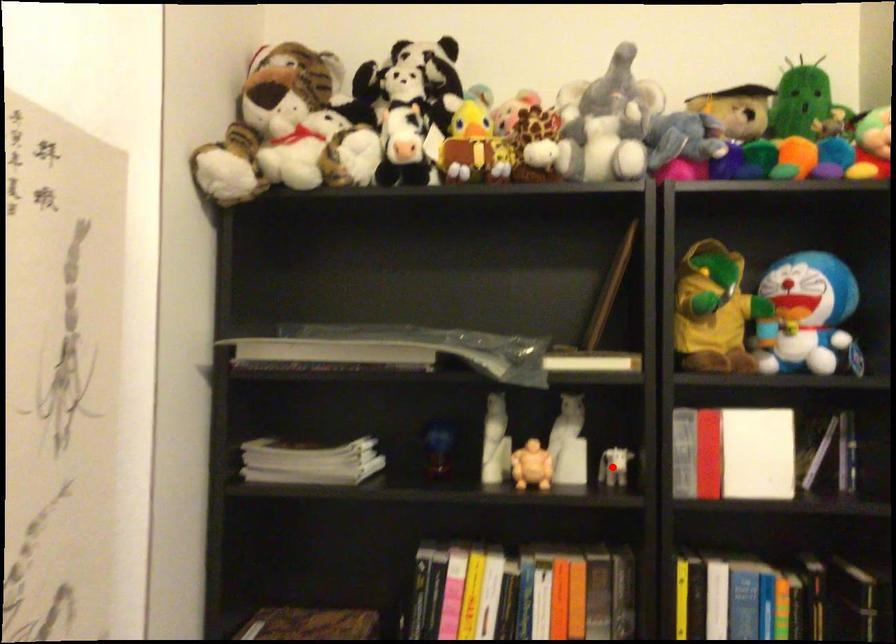
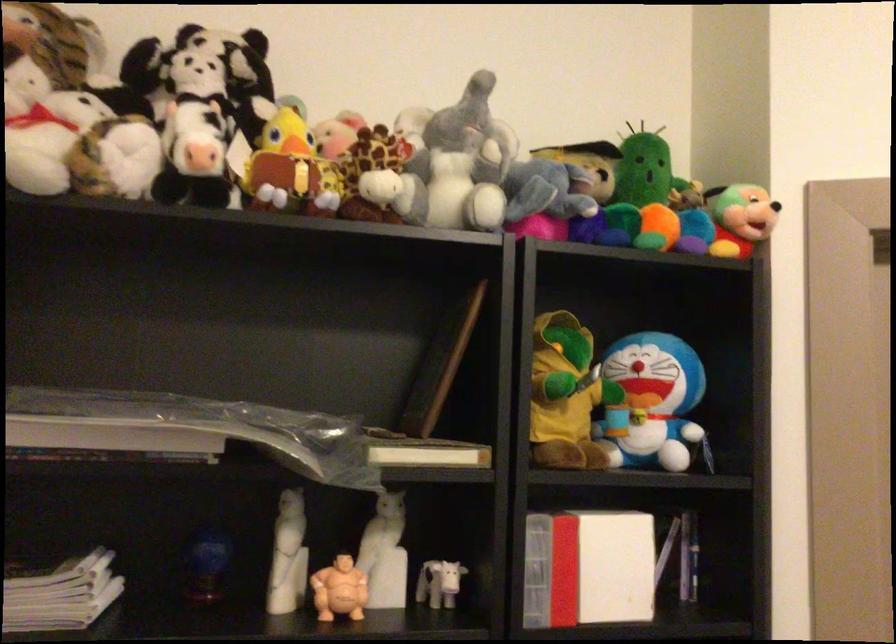
Locate, in the second image, the point that corresponds to the highlighted location in the first image.

(438, 583)